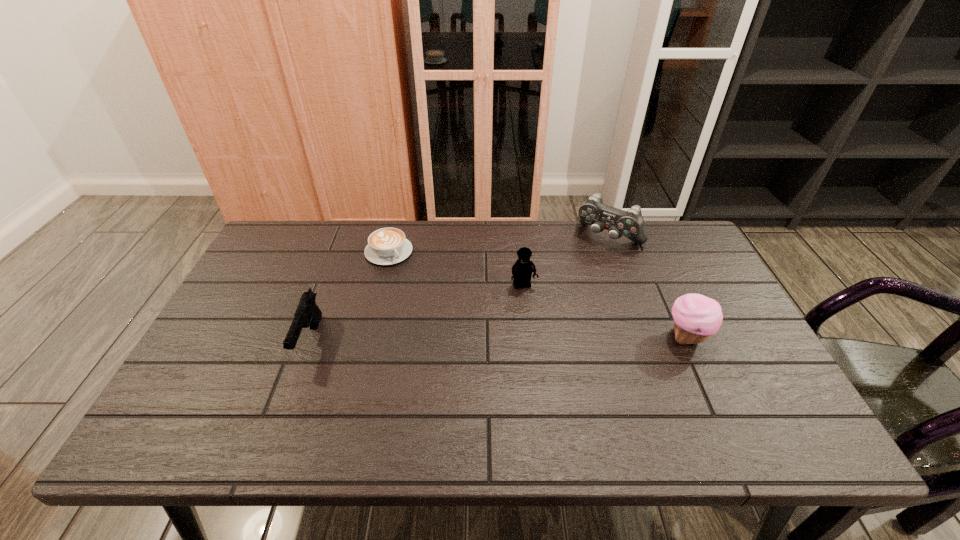
Where is `vacant space located on the side of the shortest object with the handle`? The height and width of the screenshot is (540, 960). vacant space located on the side of the shortest object with the handle is located at coordinates (425, 297).

Identify the location of vacant space located 0.110m on the side of the shortest object with the handle. The height and width of the screenshot is (540, 960). pyautogui.click(x=416, y=285).

Image resolution: width=960 pixels, height=540 pixels. Find the location of `vacant area situated on the front-facing side of the third object from left to right`. vacant area situated on the front-facing side of the third object from left to right is located at coordinates (541, 332).

Locate an element on the screen. Image resolution: width=960 pixels, height=540 pixels. free space located on the front-facing side of the third object from left to right is located at coordinates click(x=556, y=373).

Locate an element on the screen. vacant position located on the front-facing side of the third object from left to right is located at coordinates (540, 329).

The height and width of the screenshot is (540, 960). What are the coordinates of `blank space located 0.080m on the surface of the control with buttons` in the screenshot? It's located at 585,265.

At what (x,y) coordinates should I click in order to perform the action: click on free space located 0.120m on the surface of the control with buttons. Please return your answer as a coordinate pair (x, y). The image size is (960, 540). Looking at the image, I should click on (579, 272).

At what (x,y) coordinates should I click in order to perform the action: click on vacant area situated on the surface of the control with buttons. Please return your answer as a coordinate pair (x, y). The width and height of the screenshot is (960, 540). Looking at the image, I should click on (542, 319).

Locate an element on the screen. Image resolution: width=960 pixels, height=540 pixels. cappuccino that is at the far edge is located at coordinates (386, 246).

This screenshot has width=960, height=540. I want to click on control at the far edge, so click(630, 224).